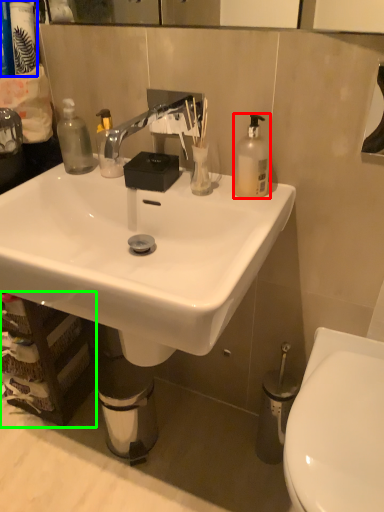
Question: Which object is the farthest from bottle (highlighted by a red box)? Choose among these: toiletries (highlighted by a blue box) or cabinetry (highlighted by a green box).

Choices:
 (A) toiletries
 (B) cabinetry

Answer: (B)